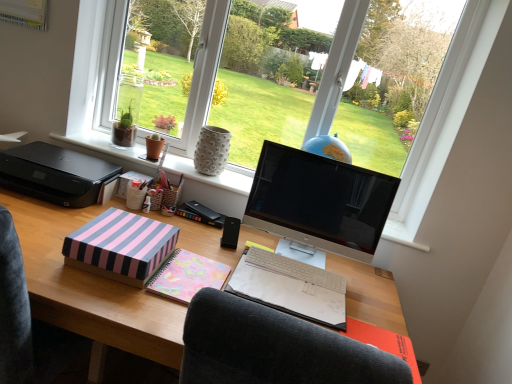
Identify the location of free spot above pastel butterfly-patterned paper at center (from a real-world perspective). (196, 272).